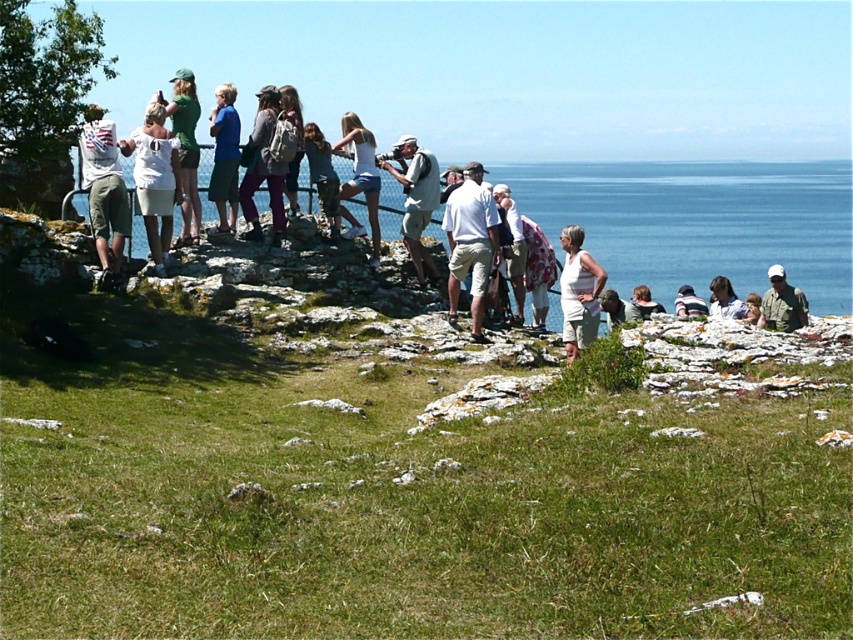
Question: Which point is farther to the camera?

Choices:
 (A) (663, 308)
 (B) (167, 225)
 (C) (689, 296)
 (D) (305, 148)

Answer: (A)

Question: Can you confirm if light brown leather jacket at center is positioned above dark blue shirt at center?

Choices:
 (A) no
 (B) yes

Answer: (B)

Question: Which point is closer to the camera?

Choices:
 (A) (799, 291)
 (B) (318, 157)
 (C) (730, 294)

Answer: (B)

Question: Can you confirm if matte purple pants at center is positioned to the right of light brown leather jacket at center?

Choices:
 (A) yes
 (B) no

Answer: (B)

Question: Where is matte black camera at center located in relation to dark blue shirt at center in the image?

Choices:
 (A) left
 (B) right

Answer: (B)

Question: Among these objects, which one is farthest from the camera?

Choices:
 (A) light gray fabric camera at center
 (B) green fabric shirt at center

Answer: (B)